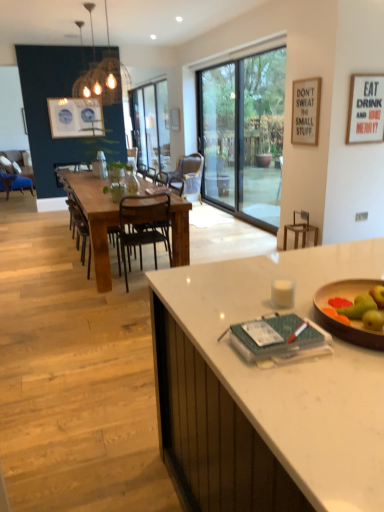
The image size is (384, 512). Describe the element at coordinates (174, 119) in the screenshot. I see `matte white picture frame at center, the 3th picture frame positioned from the bottom` at that location.

Find the location of a particular element. Image resolution: width=384 pixels, height=512 pixels. matte white picture frame at center, the 3th picture frame positioned from the bottom is located at coordinates (174, 119).

In order to face transparent glass screen door at center, should I rotate leftwards or rightwards?

A 3.303 degree turn to the right will do.

Find the location of `matte blue chair at left, acting as the first chair starting from the back`. matte blue chair at left, acting as the first chair starting from the back is located at coordinates (13, 178).

This screenshot has height=512, width=384. I want to click on white matte picture frame at upper right, which is counted as the 3th picture frame, starting from the top, so click(x=366, y=109).

Considering the relative sizes of matte blue chair at left, acting as the first chair starting from the back, and transparent glass screen door at center in the image provided, is matte blue chair at left, acting as the first chair starting from the back, smaller than transparent glass screen door at center?

Yes.

Which of these two, matte blue chair at left, acting as the first chair starting from the back, or transparent glass screen door at center, is thinner?

With smaller width is transparent glass screen door at center.

Consider the image. From the image's perspective, relative to transparent glass screen door at center, is matte blue chair at left, acting as the first chair starting from the back, above or below?

Clearly, from the image's perspective, matte blue chair at left, acting as the first chair starting from the back, is below transparent glass screen door at center.

Choose the correct answer: Is matte blue chair at left, the fifth chair when ordered from front to back, inside transparent glass screen door at center or outside it?

matte blue chair at left, the fifth chair when ordered from front to back, is not enclosed by transparent glass screen door at center.

Which is closer to the camera, (87, 175) or (177, 130)?

Point (87, 175) is closer to the camera than point (177, 130).

Would you say rustic wood table at center is outside matte white picture frame at center, the 3th picture frame from the right?

That's correct, rustic wood table at center is outside of matte white picture frame at center, the 3th picture frame from the right.

Does rustic wood table at center have a greater width compared to matte white picture frame at center, acting as the 1th picture frame starting from the back?

Indeed, rustic wood table at center has a greater width compared to matte white picture frame at center, acting as the 1th picture frame starting from the back.

Where is `kitchen & dining room table on the left of matte white picture frame at center, positioned as the first picture frame in left-to-right order`? This screenshot has height=512, width=384. kitchen & dining room table on the left of matte white picture frame at center, positioned as the first picture frame in left-to-right order is located at coordinates (96, 220).

Which object is further away from the camera taking this photo, blue ceramic plates at upper left or white matte picture frame at upper right, the second picture frame positioned from the left?

Positioned behind is blue ceramic plates at upper left.

Which of these two, blue ceramic plates at upper left or white matte picture frame at upper right, the second picture frame when ordered from front to back, stands taller?

blue ceramic plates at upper left.

From the image's perspective, who appears lower, blue ceramic plates at upper left or white matte picture frame at upper right, acting as the second picture frame starting from the bottom?

white matte picture frame at upper right, acting as the second picture frame starting from the bottom, is shown below in the image.

Between point (99, 152) and point (53, 128), which one is positioned in front?

Positioned in front is point (99, 152).

How different are the orientations of clear glass bottle at center and blue ceramic plates at upper left in degrees?

1.23 degrees separate the facing orientations of clear glass bottle at center and blue ceramic plates at upper left.

Is clear glass bottle at center turned away from blue ceramic plates at upper left?

Correct, clear glass bottle at center is looking away from blue ceramic plates at upper left.

Who is shorter, clear glass bottle at center or blue ceramic plates at upper left?

clear glass bottle at center is shorter.

Image resolution: width=384 pixels, height=512 pixels. What are the coordinates of `chair that is the 4th object to the left of the transparent glass window at center, starting at the anchor` in the screenshot? It's located at (x=80, y=230).

Between transparent glass window at center and brown wooden chair at center, which is the 4th chair from back to front, which one has larger size?

Bigger between the two is transparent glass window at center.

Does transparent glass window at center have a lesser height compared to brown wooden chair at center, the 2th chair viewed from the front?

Incorrect, the height of transparent glass window at center does not fall short of that of brown wooden chair at center, the 2th chair viewed from the front.

Between transparent glass window at center and brown wooden chair at center, the 2th chair viewed from the front, which one is positioned in front?

brown wooden chair at center, the 2th chair viewed from the front, is in front.

From the image's perspective, is woven wood pendant light at upper center located above or below brown wooden bar stool at center?

woven wood pendant light at upper center is situated higher than brown wooden bar stool at center in the image.

Is woven wood pendant light at upper center not within brown wooden bar stool at center?

That's correct, woven wood pendant light at upper center is outside of brown wooden bar stool at center.

Is woven wood pendant light at upper center facing towards brown wooden bar stool at center?

No, woven wood pendant light at upper center is not aimed at brown wooden bar stool at center.

Would you say wooden chair at center, which appears as the fifth chair when viewed from the left, contains white matte picture frame at upper right, the second picture frame positioned from the right?

No, white matte picture frame at upper right, the second picture frame positioned from the right, is not a part of wooden chair at center, which appears as the fifth chair when viewed from the left.

What's the angular difference between wooden chair at center, placed as the 1th chair when sorted from right to left, and white matte picture frame at upper right, acting as the second picture frame starting from the bottom,'s facing directions?

20.4 degrees separate the facing orientations of wooden chair at center, placed as the 1th chair when sorted from right to left, and white matte picture frame at upper right, acting as the second picture frame starting from the bottom.

From a real-world perspective, which object rests below the other?

From a 3D spatial view, wooden chair at center, the 4th chair viewed from the front, is below.

From the picture: From the image's perspective, is wooden chair at center, which is the second chair from back to front, located beneath white matte picture frame at upper right, the second picture frame positioned from the left?

Indeed, from the image's perspective, wooden chair at center, which is the second chair from back to front, is shown beneath white matte picture frame at upper right, the second picture frame positioned from the left.

In order to click on the 5th chair counting from the left side of the transparent glass screen door at center in this screenshot , I will do `click(13, 178)`.

Identify the location of kitchen & dining room table located underneath the matte white picture frame at center, the 3th picture frame from the right (from a real-world perspective). Image resolution: width=384 pixels, height=512 pixels. (96, 220).

Which object lies further to the anchor point brown wooden chair at center, placed as the third chair when sorted from left to right, clear glass bottle at center or blue ceramic plates at upper left?

Among the two, blue ceramic plates at upper left is located further to brown wooden chair at center, placed as the third chair when sorted from left to right.

Estimate the real-world distances between objects in this image. Which object is closer to white matte picture frame at upper right, the second picture frame positioned from the left, transparent glass window at center or wooden bowl at center?

transparent glass window at center lies closer to white matte picture frame at upper right, the second picture frame positioned from the left, than the other object.

From the image, which object appears to be farther from white marble desk at center, green matte apple at right or white matte picture frame at upper right, acting as the second picture frame starting from the bottom?

Based on the image, white matte picture frame at upper right, acting as the second picture frame starting from the bottom, appears to be further to white marble desk at center.

Considering their positions, is rustic wood chair at center, which is the 3th chair from back to front, positioned closer to rustic wood table at center than woven wood pendant light at upper center?

The object closer to rustic wood table at center is rustic wood chair at center, which is the 3th chair from back to front.

Looking at the image, which one is located closer to brown wooden bar stool at center, transparent glass screen door at center or wooden bowl at center?

transparent glass screen door at center is positioned closer to the anchor brown wooden bar stool at center.

From the image, which object appears to be nearer to white marble desk at center, wooden chair at center, which is the second chair from back to front, or wooden bowl at center?

Among the two, wooden bowl at center is located nearer to white marble desk at center.

Estimate the real-world distances between objects in this image. Which object is further from transparent glass screen door at center, rustic wood table at center or wooden bowl at center?

wooden bowl at center.

Which object lies nearer to the anchor point transparent glass screen door at center, rustic wood chair at center, the 3th chair viewed from the front, or white marble desk at center?

rustic wood chair at center, the 3th chair viewed from the front, is positioned closer to the anchor transparent glass screen door at center.

This screenshot has height=512, width=384. In order to click on window screen between brown wooden chair at center, the fourth chair when ordered from right to left, and matte white picture frame at center, positioned as the first picture frame in left-to-right order, in the front-back direction in this screenshot , I will do `click(261, 134)`.

Where is `lamp between green matte apple at right and wooden chair at center, which appears as the fifth chair when viewed from the left, along the z-axis`? lamp between green matte apple at right and wooden chair at center, which appears as the fifth chair when viewed from the left, along the z-axis is located at coordinates pyautogui.click(x=102, y=74).

This screenshot has height=512, width=384. I want to click on chair located between rustic wood chair at center, marked as the 4th chair in a left-to-right arrangement, and matte blue chair at left, the 5th chair viewed from the right, in the depth direction, so click(186, 175).

Where is `chair situated between brown wooden chair at center, which is the 4th chair from back to front, and rustic wood chair at center, which is the second chair from right to left, from left to right`? chair situated between brown wooden chair at center, which is the 4th chair from back to front, and rustic wood chair at center, which is the second chair from right to left, from left to right is located at coordinates (144, 225).